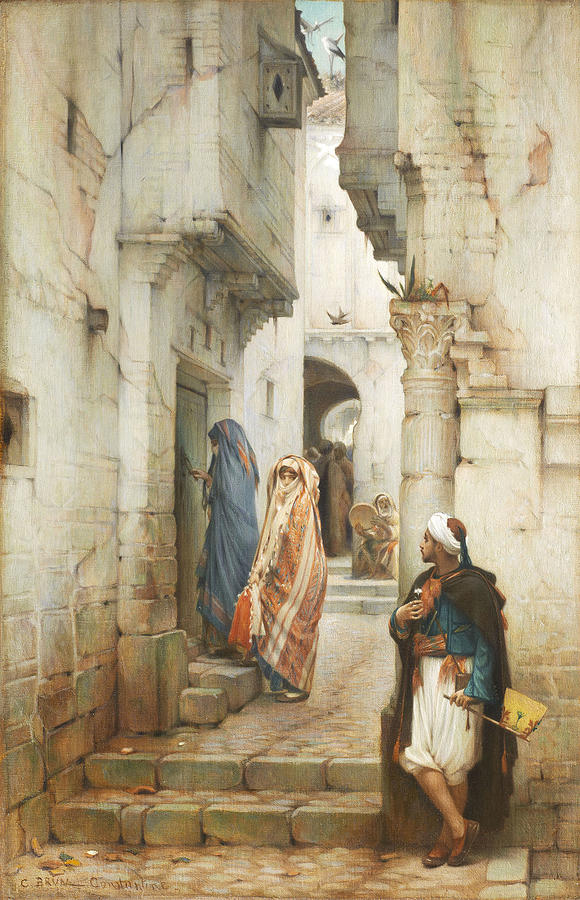
Locate an element on the screen. Image resolution: width=580 pixels, height=900 pixels. door is located at coordinates (191, 439).